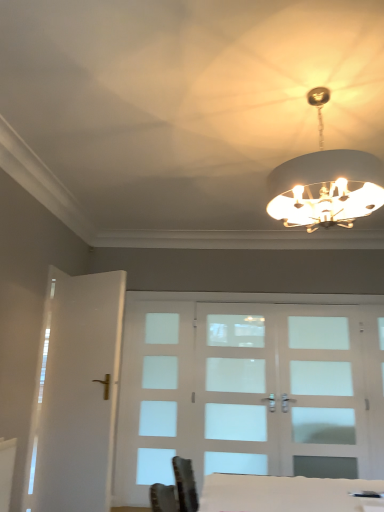
Locate an element on the screen. The height and width of the screenshot is (512, 384). vacant area on top of white glass chandelier at upper center (from a real-world perspective) is located at coordinates (336, 77).